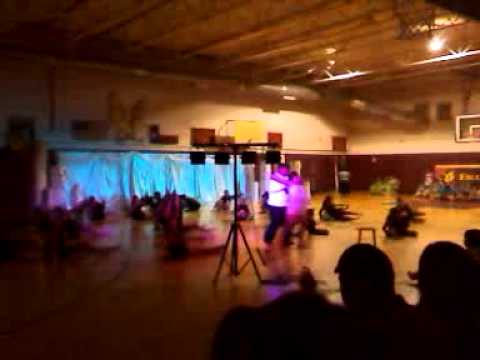
Locate an element on the screen. This screenshot has width=480, height=360. curtain is located at coordinates (148, 169), (86, 179), (190, 179).